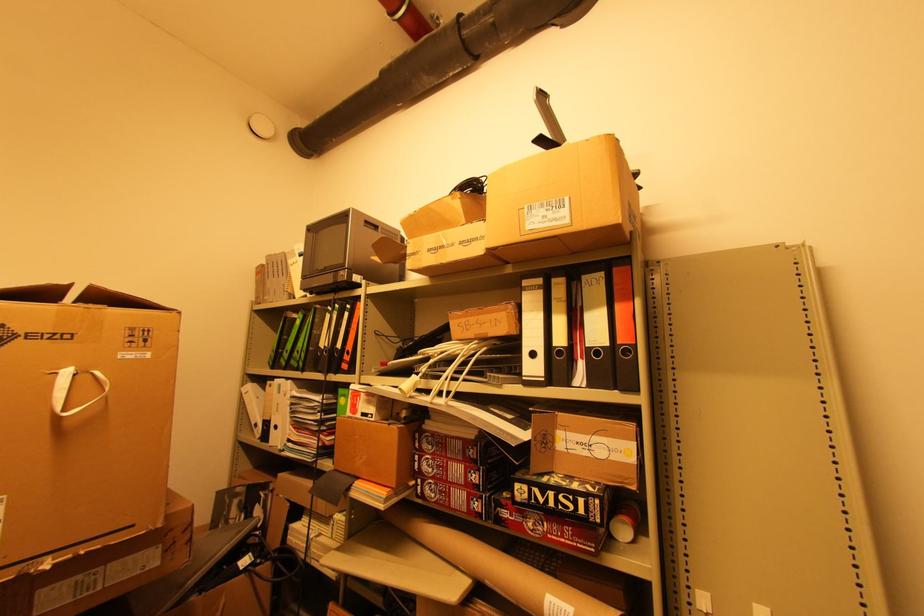
Find where to lift the small gray microwave. Please return your answer as a coordinate pair (x, y).

(345, 253)